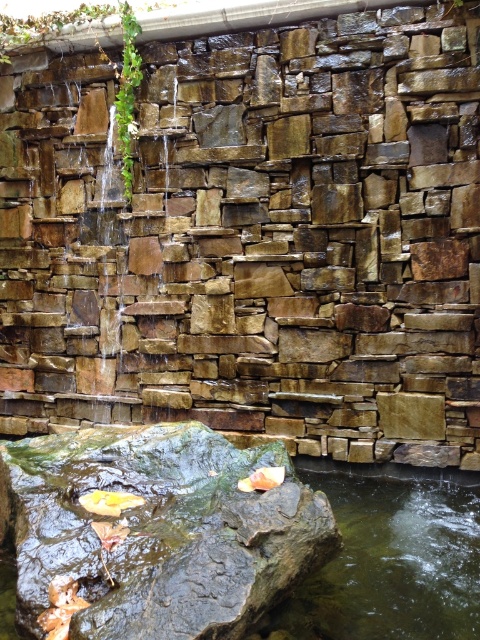
You are a hiker who wants to place a small rock garden decoration between the brown rough stone at center and the rough textured rock at center. Based on their positions, which stone should you place the decoration closer to the left side of?

The brown rough stone at center is positioned on the right side of rough textured rock at center, so you should place the decoration closer to the left side of the rough textured rock at center.

In the scene shown: You are standing in front of the stone wall with the waterfall. You notice two points marked on the wall. The first point is at coordinates point (206,136) and the second is at point (313,518). If you were to draw a straight line between these two points, would the line pass through the waterfall area?

The line between point (206,136) and point (313,518) would pass through the waterfall area because the first point is behind the second point, implying it is closer to the viewer. Since the waterfall originates from the top left, the line would cross the waterfall path.